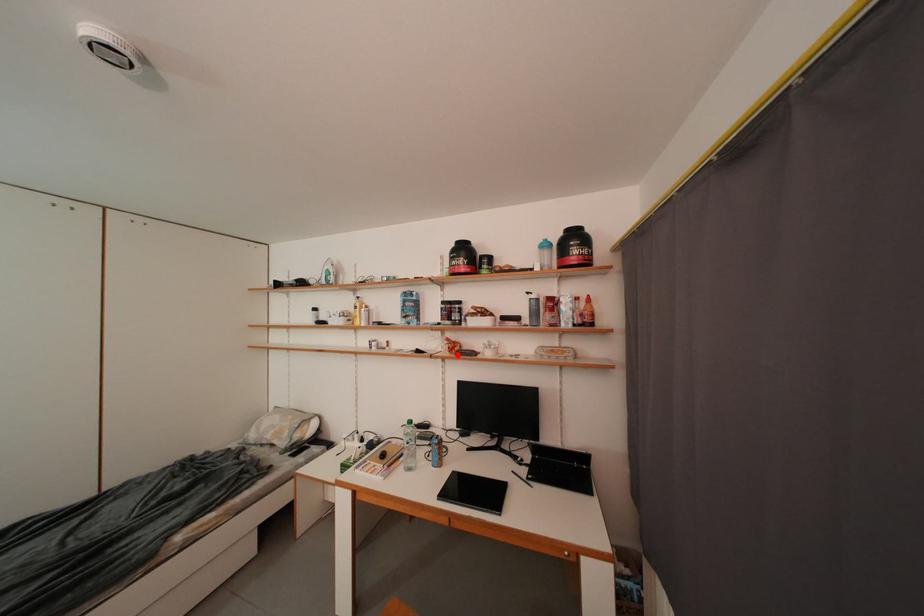
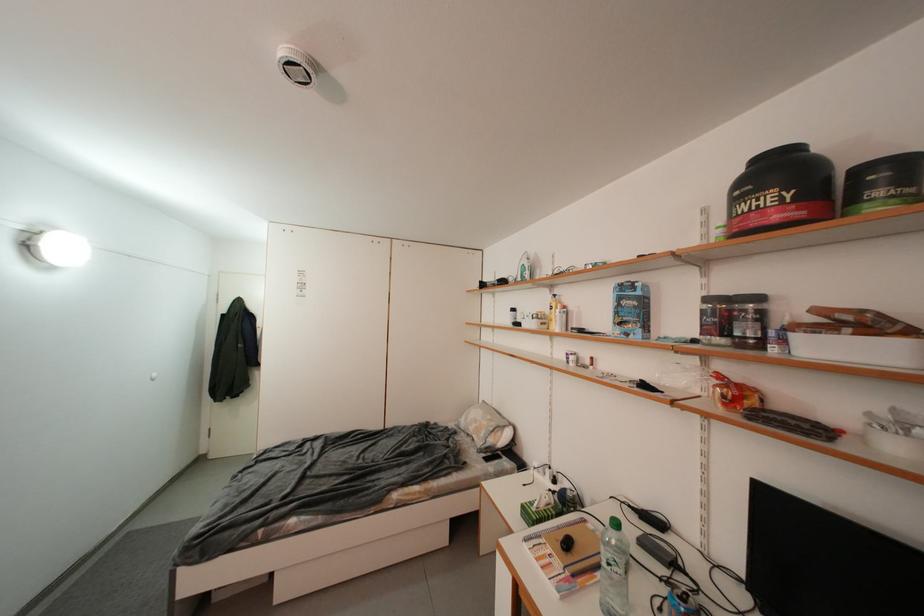
The point at the highlighted location is marked in the first image. Where is the corresponding point in the second image?

(733, 408)